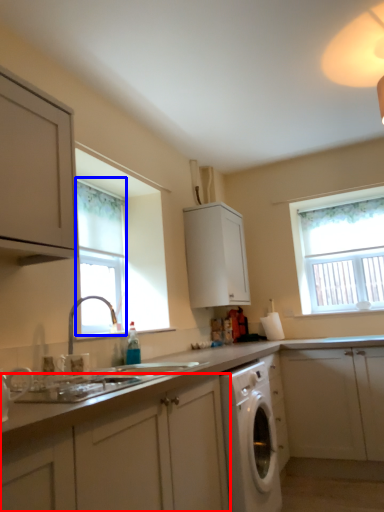
Question: Which point is further to the camera, cabinetry (highlighted by a red box) or window (highlighted by a blue box)?

Choices:
 (A) cabinetry
 (B) window

Answer: (B)